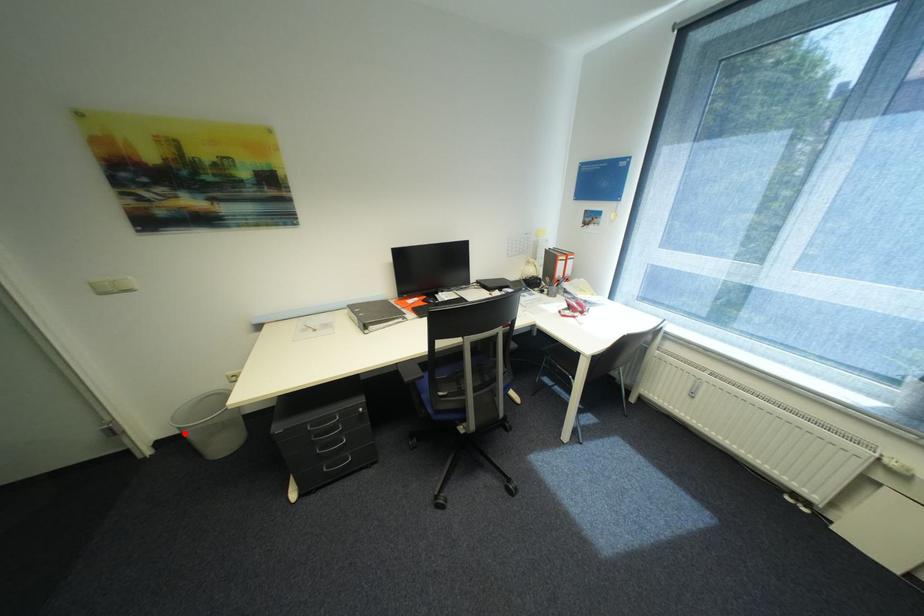
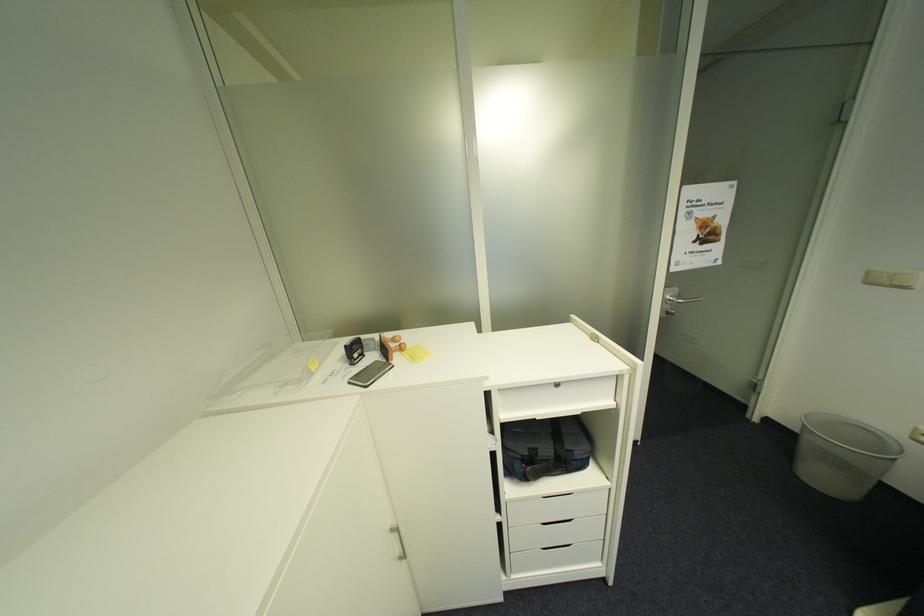
Find the pixel in the second image that matches the highlighted location in the first image.

(805, 429)